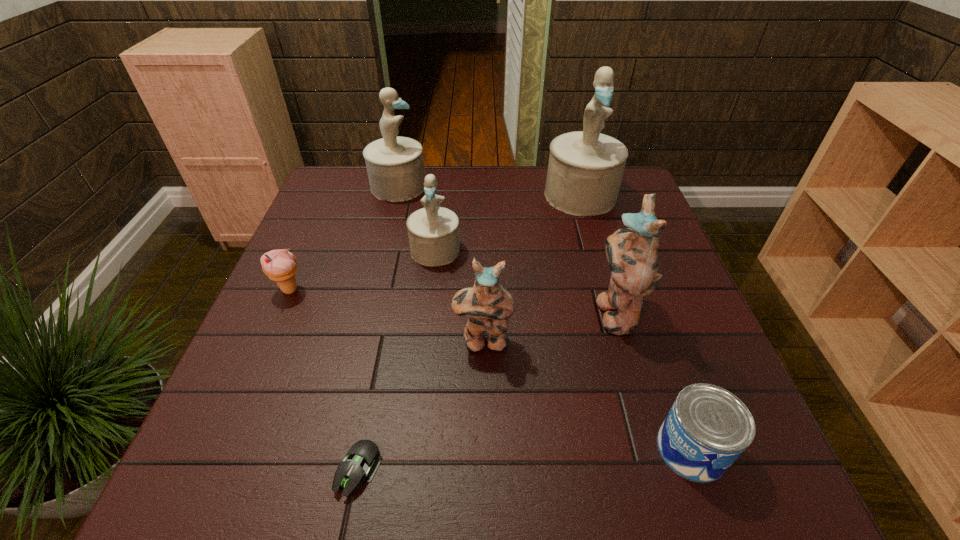
Locate an element on the screen. the biggest white figurine is located at coordinates (585, 169).

This screenshot has height=540, width=960. I want to click on the rightmost white figurine, so [585, 169].

Locate an element on the screen. The height and width of the screenshot is (540, 960). the second smallest white figurine is located at coordinates (395, 167).

You are a GUI agent. You are given a task and a screenshot of the screen. Output one action in this format:
    pyautogui.click(x=<x>, y=<y>)
    Task: Click on the bigger pink figurine
    The width and height of the screenshot is (960, 540).
    Given the screenshot: What is the action you would take?
    pyautogui.click(x=632, y=254)

You are a GUI agent. You are given a task and a screenshot of the screen. Output one action in this format:
    pyautogui.click(x=<x>, y=<y>)
    Task: Click on the smallest white figurine
    The width and height of the screenshot is (960, 540).
    Given the screenshot: What is the action you would take?
    pyautogui.click(x=433, y=231)

Find the location of a particular element. Image resolution: width=960 pixels, height=540 pixels. the nearest white figurine is located at coordinates (433, 231).

Identify the location of the left pink figurine. This screenshot has height=540, width=960. (488, 305).

Where is `icecream`? icecream is located at coordinates (280, 265).

At what (x,y) coordinates should I click in order to perform the action: click on the third shortest object. Please return your answer as a coordinate pair (x, y). Looking at the image, I should click on (280, 265).

Find the location of `can`. can is located at coordinates (707, 428).